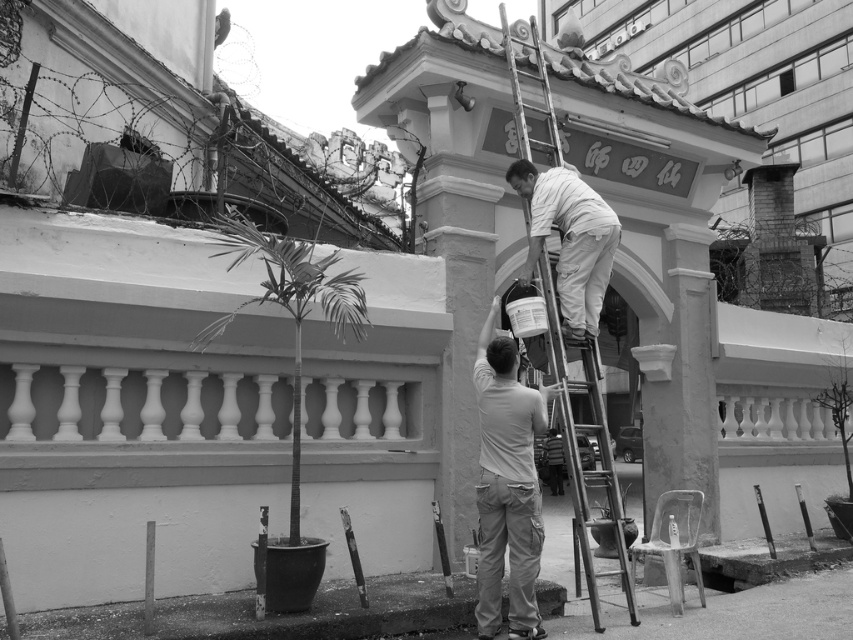
Question: Does light gray cotton shirt at center appear under white matte paint canister at upper center?

Choices:
 (A) no
 (B) yes

Answer: (B)

Question: Can you confirm if light gray cotton shirt at center is positioned above white matte paint canister at upper center?

Choices:
 (A) yes
 (B) no

Answer: (B)

Question: Which point is farther from the camera taking this photo?

Choices:
 (A) (521, 145)
 (B) (527, 442)
 (C) (601, 275)

Answer: (A)

Question: Among these objects, which one is nearest to the camera?

Choices:
 (A) white matte paint canister at upper center
 (B) light gray cotton shirt at center
 (C) metallic silver ladder at center

Answer: (B)

Question: Which of the following is the closest to the observer?

Choices:
 (A) (599, 294)
 (B) (576, 472)

Answer: (B)

Question: Does light gray cotton shirt at center lie in front of metallic silver ladder at center?

Choices:
 (A) no
 (B) yes

Answer: (B)